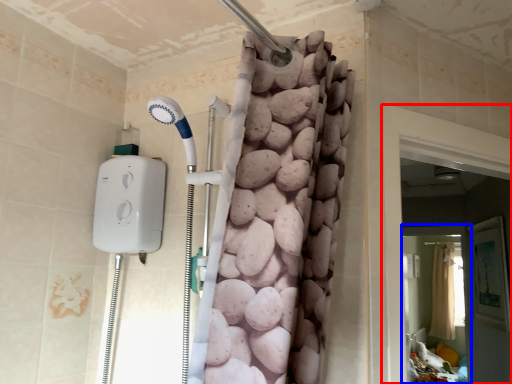
Question: Which object appears farthest to the camera in this image, screen door (highlighted by a red box) or screen door (highlighted by a blue box)?

Choices:
 (A) screen door
 (B) screen door

Answer: (B)